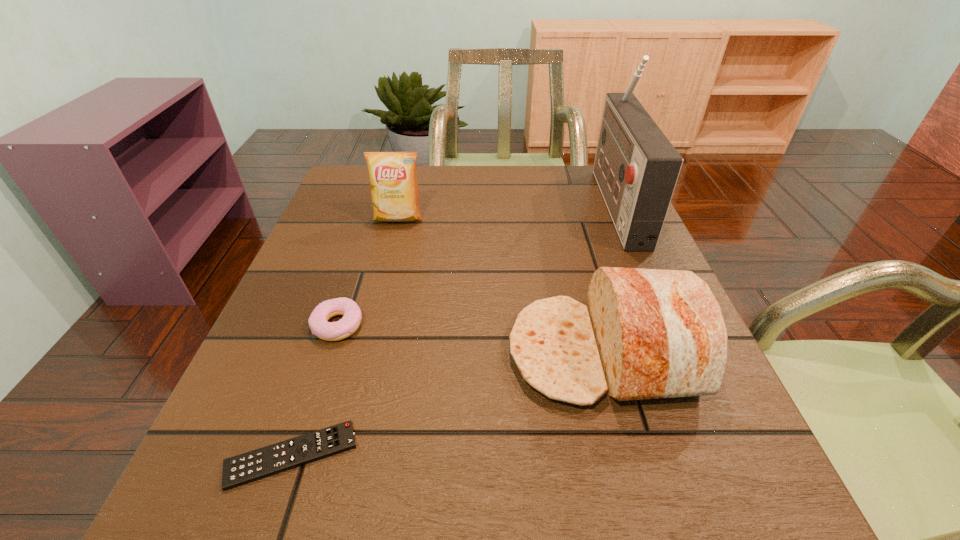
In order to click on radio receiver in this screenshot , I will do `click(636, 167)`.

At what (x,y) coordinates should I click in order to perform the action: click on crisp (potato chip). Please return your answer as a coordinate pair (x, y). Looking at the image, I should click on (394, 190).

The image size is (960, 540). Find the location of `bread`. bread is located at coordinates (647, 333).

Locate an element on the screen. The height and width of the screenshot is (540, 960). the fourth tallest object is located at coordinates (330, 331).

The height and width of the screenshot is (540, 960). In order to click on the nearest object in this screenshot , I will do `click(251, 466)`.

Identify the location of remote control. (251, 466).

Where is `free space located 0.080m on the front panel of the tallest object`? free space located 0.080m on the front panel of the tallest object is located at coordinates (568, 203).

In order to click on vacant area situated 0.070m on the front panel of the tallest object in this screenshot , I will do `click(572, 203)`.

You are a GUI agent. You are given a task and a screenshot of the screen. Output one action in this format:
    pyautogui.click(x=<x>, y=<y>)
    Task: Click on the free location located 0.120m on the front panel of the tallest object
    This screenshot has height=540, width=960.
    Given the screenshot: What is the action you would take?
    pyautogui.click(x=553, y=203)

You are a GUI agent. You are given a task and a screenshot of the screen. Output one action in this format:
    pyautogui.click(x=<x>, y=<y>)
    Task: Click on the vacant area situated 0.090m on the front-facing side of the crisp (potato chip)
    Image resolution: width=960 pixels, height=540 pixels.
    Given the screenshot: What is the action you would take?
    pyautogui.click(x=391, y=250)